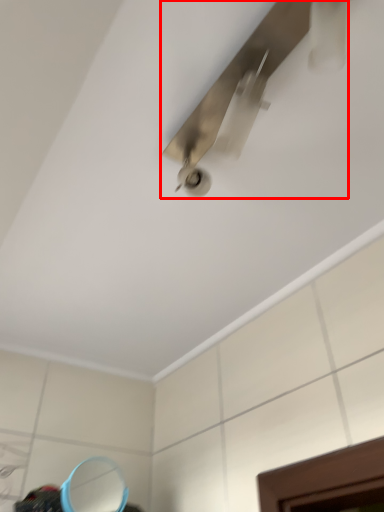
Question: From the image's perspective, what is the correct spatial relationship of ceiling fan (annotated by the red box) in relation to mirror?

Choices:
 (A) above
 (B) below

Answer: (A)